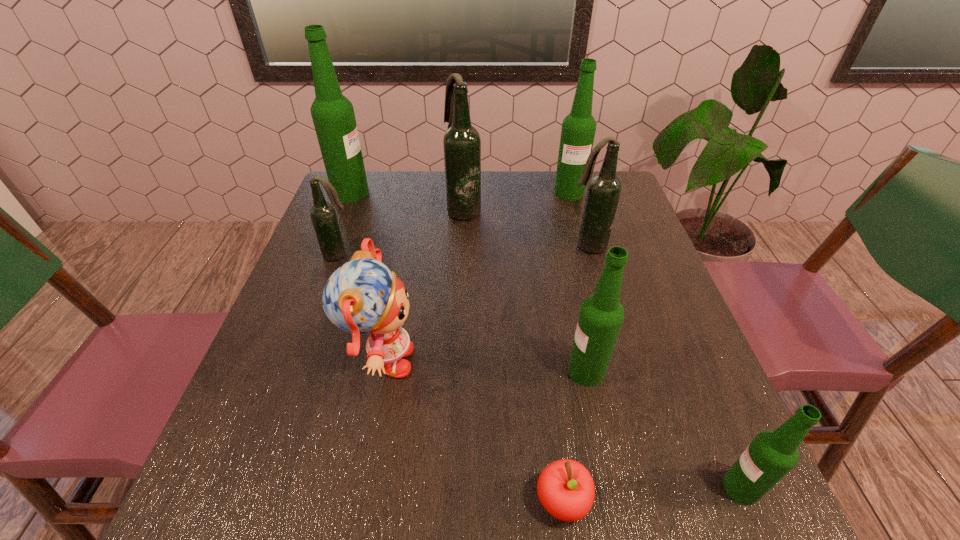
Find the location of `unoccupied area between the fifth object from right to left and the third smallest green beer bottle`. unoccupied area between the fifth object from right to left and the third smallest green beer bottle is located at coordinates (565, 347).

Where is `empty location between the biggest dark beer bottle and the sixth farthest beer bottle`? empty location between the biggest dark beer bottle and the sixth farthest beer bottle is located at coordinates (525, 291).

The image size is (960, 540). Find the location of `free area in between the rightmost object and the shortest object`. free area in between the rightmost object and the shortest object is located at coordinates (652, 495).

At what (x,y) coordinates should I click in order to perform the action: click on free space between the third smallest green beer bottle and the third farthest green beer bottle. Please return your answer as a coordinate pair (x, y). This screenshot has width=960, height=540. Looking at the image, I should click on (578, 282).

The width and height of the screenshot is (960, 540). Identify the location of vacant area that lies between the nearest green beer bottle and the shortest object. (652, 495).

The height and width of the screenshot is (540, 960). Identify the location of unoccupied position between the biggest dark beer bottle and the red apple. (514, 355).

You are a GUI agent. You are given a task and a screenshot of the screen. Output one action in this format:
    pyautogui.click(x=<x>, y=<y>)
    Task: Click on the object that is the second closest to the red apple
    This screenshot has width=960, height=540.
    Given the screenshot: What is the action you would take?
    pyautogui.click(x=771, y=455)

At what (x,y) coordinates should I click in order to perform the action: click on object that stands as the sixth closest to the leftmost dark beer bottle. Please return your answer as a coordinate pair (x, y). Image resolution: width=960 pixels, height=540 pixels. Looking at the image, I should click on (578, 130).

Locate which beer bottle ranks sixth in proximity to the second biggest green beer bottle. Please provide its 2D coordinates. Your answer should be formatted as a tuple, i.e. [(x, y)], where the tuple contains the x and y coordinates of a point satisfying the conditions above.

[(771, 455)]

Identify the location of beer bottle that is the sixth closest to the third object from left to right. (771, 455).